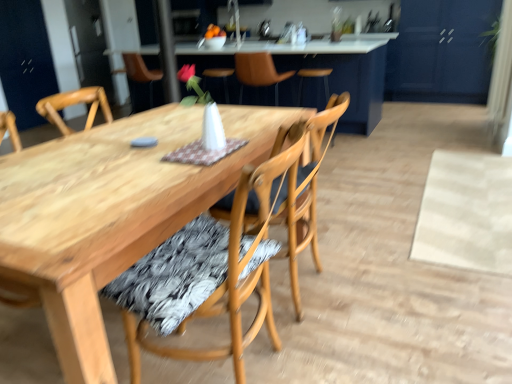
Question: From a real-world perspective, is wooden table at center physically below blue matte cabinet at upper right?

Choices:
 (A) yes
 (B) no

Answer: (A)

Question: Considering the relative sizes of wooden table at center and blue matte cabinet at upper right in the image provided, is wooden table at center shorter than blue matte cabinet at upper right?

Choices:
 (A) yes
 (B) no

Answer: (A)

Question: Is wooden table at center completely or partially outside of blue matte cabinet at upper right?

Choices:
 (A) no
 (B) yes

Answer: (B)

Question: Is wooden table at center wider than blue matte cabinet at upper right?

Choices:
 (A) no
 (B) yes

Answer: (B)

Question: Can blue matte cabinet at upper right be found inside wooden table at center?

Choices:
 (A) no
 (B) yes

Answer: (A)

Question: Is wooden table at center with blue matte cabinet at upper right?

Choices:
 (A) yes
 (B) no

Answer: (B)

Question: Is wooden chair at center, positioned as the 3th chair in back-to-front order, behind leather at center, acting as the first chair starting from the back?

Choices:
 (A) no
 (B) yes

Answer: (A)

Question: From the image's perspective, does wooden chair at center, which is the first chair in front-to-back order, appear higher than leather at center, which is the 3th chair in front-to-back order?

Choices:
 (A) no
 (B) yes

Answer: (A)

Question: Can you confirm if wooden chair at center, which is the first chair in front-to-back order, is smaller than leather at center, acting as the first chair starting from the back?

Choices:
 (A) no
 (B) yes

Answer: (A)

Question: Is wooden chair at center, which is the first chair in front-to-back order, in front of leather at center, which is the 3th chair in front-to-back order?

Choices:
 (A) yes
 (B) no

Answer: (A)

Question: Does wooden chair at center, which is the first chair in front-to-back order, touch leather at center, which is the 3th chair in front-to-back order?

Choices:
 (A) no
 (B) yes

Answer: (A)

Question: Is wooden chair at center, which is the first chair in front-to-back order, looking in the opposite direction of leather at center, acting as the first chair starting from the back?

Choices:
 (A) yes
 (B) no

Answer: (B)

Question: Is wooden chair at center, placed as the 2th chair when sorted from back to front, not close to leather at center, which is the 3th chair in front-to-back order?

Choices:
 (A) no
 (B) yes

Answer: (B)